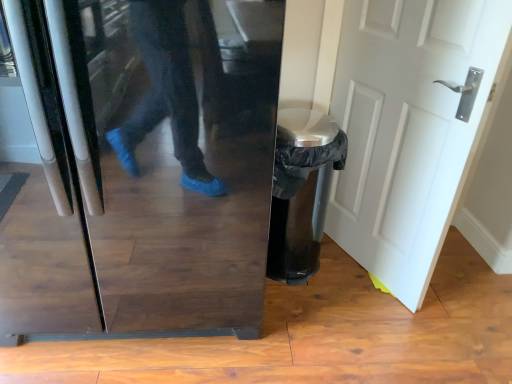
What do you see at coordinates (409, 128) in the screenshot? The height and width of the screenshot is (384, 512). I see `white matte door at center` at bounding box center [409, 128].

What are the coordinates of `white matte door at center` in the screenshot? It's located at (409, 128).

The width and height of the screenshot is (512, 384). What are the coordinates of `glossy black refrigerator at center` in the screenshot? It's located at (158, 166).

In order to face glossy black refrigerator at center, should I rotate leftwards or rightwards?

It's best to rotate left around 16.153 degrees.

The width and height of the screenshot is (512, 384). Describe the element at coordinates (158, 166) in the screenshot. I see `glossy black refrigerator at center` at that location.

Identify the location of white matte door at center. (409, 128).

Visually, is white matte door at center positioned to the left or to the right of glossy black refrigerator at center?

From the image, it's evident that white matte door at center is to the right of glossy black refrigerator at center.

Is white matte door at center positioned behind glossy black refrigerator at center?

That is True.

Which is behind, point (340, 222) or point (31, 69)?

The point (340, 222) is farther from the camera.

From the image's perspective, is white matte door at center below glossy black refrigerator at center?

Actually, white matte door at center appears above glossy black refrigerator at center in the image.

From a real-world perspective, which is physically below, white matte door at center or glossy black refrigerator at center?

From a 3D spatial view, white matte door at center is below.

Considering the sizes of objects white matte door at center and glossy black refrigerator at center in the image provided, who is thinner, white matte door at center or glossy black refrigerator at center?

Thinner between the two is white matte door at center.

Between white matte door at center and glossy black refrigerator at center, which one has more height?

Standing taller between the two is white matte door at center.

Who is smaller, white matte door at center or glossy black refrigerator at center?

With smaller size is white matte door at center.

Consider the image. Can glossy black refrigerator at center be found inside white matte door at center?

No, glossy black refrigerator at center is not inside white matte door at center.

Is white matte door at center next to glossy black refrigerator at center and touching it?

white matte door at center is not next to glossy black refrigerator at center, and they're not touching.

Is white matte door at center looking in the opposite direction of glossy black refrigerator at center?

That's right, white matte door at center is facing away from glossy black refrigerator at center.

How distant is white matte door at center from glossy black refrigerator at center?

white matte door at center is 30.54 inches away from glossy black refrigerator at center.

The width and height of the screenshot is (512, 384). Find the location of `refrigerator in front of the white matte door at center`. refrigerator in front of the white matte door at center is located at coordinates (158, 166).

Considering the relative positions of glossy black refrigerator at center and white matte door at center in the image provided, is glossy black refrigerator at center to the left of white matte door at center from the viewer's perspective?

Yes.

Considering the relative positions of glossy black refrigerator at center and white matte door at center in the image provided, is glossy black refrigerator at center behind white matte door at center?

No, it is not.

Considering the points (115, 160) and (411, 73), which point is behind, point (115, 160) or point (411, 73)?

The point (411, 73) is more distant.

In the scene shown: From the image's perspective, which one is positioned higher, glossy black refrigerator at center or white matte door at center?

white matte door at center, from the image's perspective.

From a real-world perspective, which object rests below the other?

white matte door at center.

Does glossy black refrigerator at center have a greater width compared to white matte door at center?

Correct, the width of glossy black refrigerator at center exceeds that of white matte door at center.

In terms of height, does glossy black refrigerator at center look taller or shorter compared to white matte door at center?

Considering their sizes, glossy black refrigerator at center has less height than white matte door at center.

Considering the sizes of glossy black refrigerator at center and white matte door at center in the image, is glossy black refrigerator at center bigger or smaller than white matte door at center?

In the image, glossy black refrigerator at center appears to be larger than white matte door at center.

Is glossy black refrigerator at center situated inside white matte door at center or outside?

glossy black refrigerator at center is spatially situated outside white matte door at center.

Is glossy black refrigerator at center directly adjacent to white matte door at center?

They are not placed beside each other.

Consider the image. Is glossy black refrigerator at center oriented towards white matte door at center?

No, glossy black refrigerator at center is not aimed at white matte door at center.

What's the angular difference between glossy black refrigerator at center and white matte door at center's facing directions?

glossy black refrigerator at center and white matte door at center are facing 116 degrees away from each other.

The image size is (512, 384). Identify the location of door below the glossy black refrigerator at center (from a real-world perspective). (409, 128).

Image resolution: width=512 pixels, height=384 pixels. I want to click on door behind the glossy black refrigerator at center, so click(x=409, y=128).

Locate an element on the screen. This screenshot has width=512, height=384. door lying on the right of glossy black refrigerator at center is located at coordinates (409, 128).